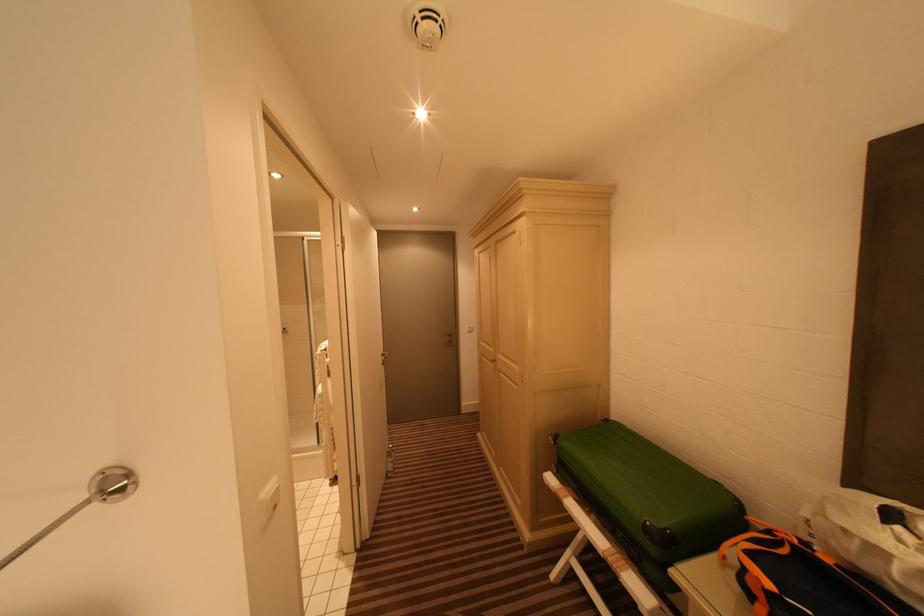
The image size is (924, 616). What are the coordinates of `gold door handle` in the screenshot? It's located at (383, 357).